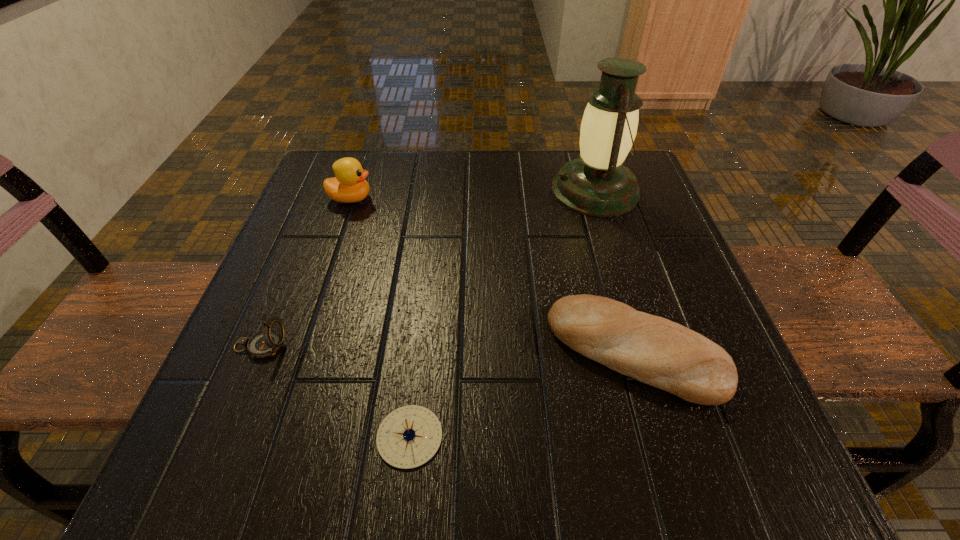
Where is `free location located on the face of the duckling`? This screenshot has height=540, width=960. free location located on the face of the duckling is located at coordinates (463, 199).

Where is `free region located on the face of the farther compass`? The image size is (960, 540). free region located on the face of the farther compass is located at coordinates (436, 346).

Where is `free space located on the left of the second shortest object`? free space located on the left of the second shortest object is located at coordinates (452, 352).

Locate an element on the screen. Image resolution: width=960 pixels, height=540 pixels. free space located on the back of the shorter compass is located at coordinates (425, 302).

Find the location of a particular element. This screenshot has width=960, height=540. lantern located in the far edge section of the desktop is located at coordinates (597, 183).

I want to click on duckling that is at the far edge, so click(349, 185).

The height and width of the screenshot is (540, 960). Identify the location of object that is at the near edge. (408, 437).

You are a GUI agent. You are given a task and a screenshot of the screen. Output one action in this format:
    pyautogui.click(x=<x>, y=<y>)
    Task: Click on the duckling situated at the left edge
    This screenshot has width=960, height=540.
    Given the screenshot: What is the action you would take?
    point(349,185)

Find the location of a particular element. The width and height of the screenshot is (960, 540). compass present at the left edge is located at coordinates (265, 343).

Locate an element on the screen. The image size is (960, 540). lantern present at the right edge is located at coordinates (597, 183).